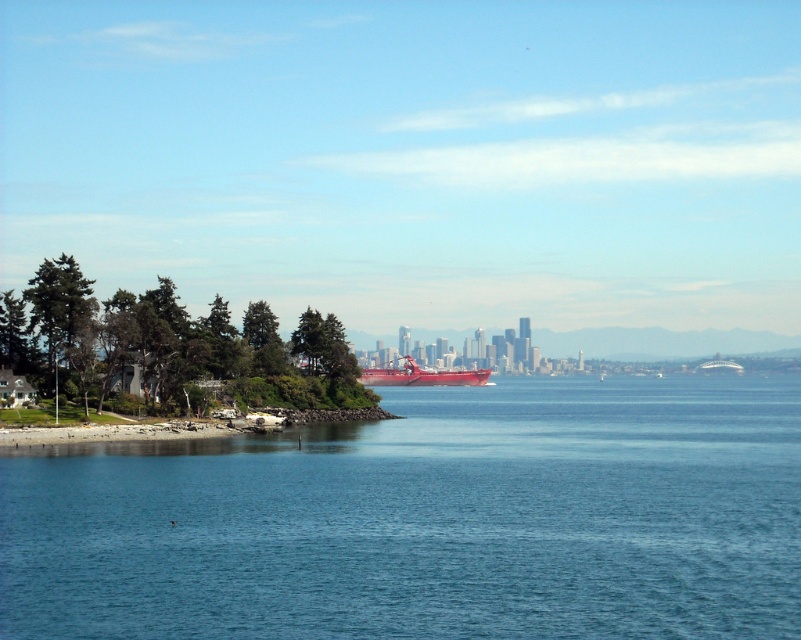
Is blue water at lower center to the left of shiny red boat at center from the viewer's perspective?

No, blue water at lower center is not to the left of shiny red boat at center.

Which is in front, point (230, 529) or point (385, 376)?

Point (230, 529) is more forward.

Between point (552, 582) and point (396, 374), which one is positioned in front?

Positioned in front is point (552, 582).

Where is `blue water at lower center`? The width and height of the screenshot is (801, 640). blue water at lower center is located at coordinates (429, 520).